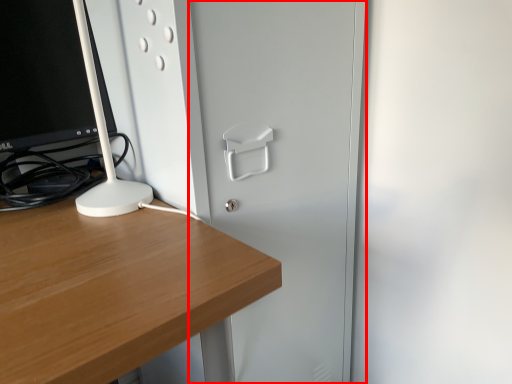
Question: Considering the relative positions of glass door (annotated by the red box) and computer monitor in the image provided, where is glass door (annotated by the red box) located with respect to the staircase?

Choices:
 (A) right
 (B) left

Answer: (A)